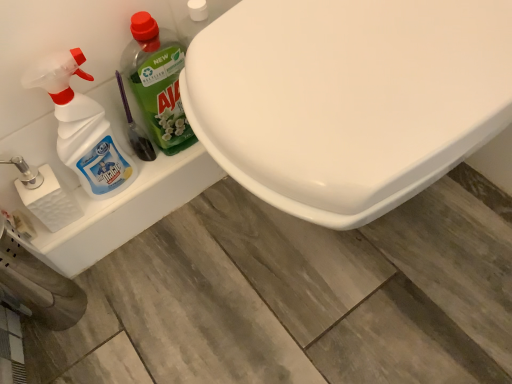
Question: Is translucent plastic spray bottle at left, which is counted as the first cleaning product, starting from the left, next to green plastic bottle at left, the 2th cleaning product from the left, and touching it?

Choices:
 (A) no
 (B) yes

Answer: (A)

Question: From the image's perspective, is translucent plastic spray bottle at left, which is counted as the first cleaning product, starting from the left, over green plastic bottle at left, positioned as the 1th cleaning product in right-to-left order?

Choices:
 (A) no
 (B) yes

Answer: (A)

Question: Is translucent plastic spray bottle at left, which is counted as the first cleaning product, starting from the left, oriented away from green plastic bottle at left, positioned as the 1th cleaning product in right-to-left order?

Choices:
 (A) yes
 (B) no

Answer: (B)

Question: Does translucent plastic spray bottle at left, which is the 2th cleaning product in right-to-left order, have a greater height compared to green plastic bottle at left, the 2th cleaning product from the left?

Choices:
 (A) yes
 (B) no

Answer: (A)

Question: Is translucent plastic spray bottle at left, which is counted as the first cleaning product, starting from the left, facing towards green plastic bottle at left, the 2th cleaning product from the left?

Choices:
 (A) yes
 (B) no

Answer: (B)

Question: Is translucent plastic spray bottle at left, which is the 2th cleaning product in right-to-left order, not near green plastic bottle at left, the 2th cleaning product from the left?

Choices:
 (A) no
 (B) yes

Answer: (A)

Question: Can white glossy toilet at center be found inside translucent plastic spray bottle at left, which is the 2th cleaning product in right-to-left order?

Choices:
 (A) no
 (B) yes

Answer: (A)

Question: From the image's perspective, is translucent plastic spray bottle at left, which is counted as the first cleaning product, starting from the left, below white glossy toilet at center?

Choices:
 (A) yes
 (B) no

Answer: (B)

Question: From a real-world perspective, is translucent plastic spray bottle at left, which is counted as the first cleaning product, starting from the left, below white glossy toilet at center?

Choices:
 (A) no
 (B) yes

Answer: (A)

Question: Is translucent plastic spray bottle at left, which is counted as the first cleaning product, starting from the left, outside of white glossy toilet at center?

Choices:
 (A) yes
 (B) no

Answer: (A)

Question: Considering the relative sizes of translucent plastic spray bottle at left, which is counted as the first cleaning product, starting from the left, and white glossy toilet at center in the image provided, is translucent plastic spray bottle at left, which is counted as the first cleaning product, starting from the left, taller than white glossy toilet at center?

Choices:
 (A) yes
 (B) no

Answer: (B)

Question: Are translucent plastic spray bottle at left, which is counted as the first cleaning product, starting from the left, and white glossy toilet at center located far from each other?

Choices:
 (A) no
 (B) yes

Answer: (A)

Question: Does white textured toilet paper at left come behind translucent plastic spray bottle at left, which is counted as the first cleaning product, starting from the left?

Choices:
 (A) no
 (B) yes

Answer: (B)